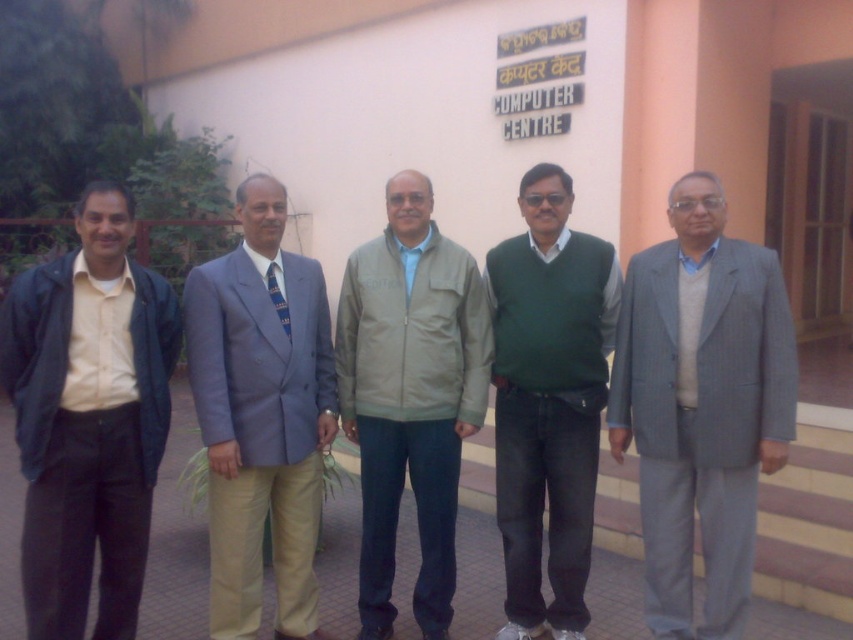
Question: Can you confirm if gray pinstripe suit at right is positioned below green sweater at center?

Choices:
 (A) no
 (B) yes

Answer: (B)

Question: Which point is closer to the camera?

Choices:
 (A) gray pinstripe suit at right
 (B) blue striped tie at center

Answer: (A)

Question: Which point is closer to the camera?

Choices:
 (A) (271, 291)
 (B) (163, 442)

Answer: (B)

Question: Does light blue fabric suit at center have a larger size compared to green sweater at center?

Choices:
 (A) yes
 (B) no

Answer: (A)

Question: Is gray pinstripe suit at right above light beige jacket at center?

Choices:
 (A) yes
 (B) no

Answer: (A)

Question: Which point appears closest to the camera in this image?

Choices:
 (A) (575, 461)
 (B) (691, 364)
 (C) (283, 307)
 (D) (418, 304)

Answer: (B)